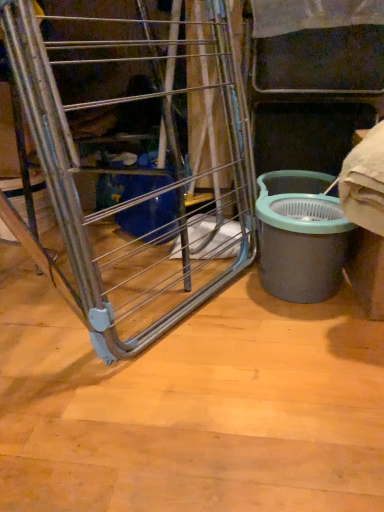
Question: From the image's perspective, relative to matte gray bucket at right, is metallic silver ladder at center above or below?

Choices:
 (A) below
 (B) above

Answer: (B)

Question: In terms of size, does metallic silver ladder at center appear bigger or smaller than matte gray bucket at right?

Choices:
 (A) big
 (B) small

Answer: (A)

Question: Is metallic silver ladder at center wider or thinner than matte gray bucket at right?

Choices:
 (A) wide
 (B) thin

Answer: (B)

Question: Is matte gray bucket at right in front of or behind metallic silver ladder at center in the image?

Choices:
 (A) front
 (B) behind

Answer: (B)

Question: Is point (261, 279) closer or farther from the camera than point (196, 173)?

Choices:
 (A) farther
 (B) closer

Answer: (B)

Question: Considering the positions of matte gray bucket at right and metallic silver ladder at center in the image, is matte gray bucket at right wider or thinner than metallic silver ladder at center?

Choices:
 (A) wide
 (B) thin

Answer: (A)

Question: From a real-world perspective, relative to metallic silver ladder at center, is matte gray bucket at right vertically above or below?

Choices:
 (A) below
 (B) above

Answer: (A)